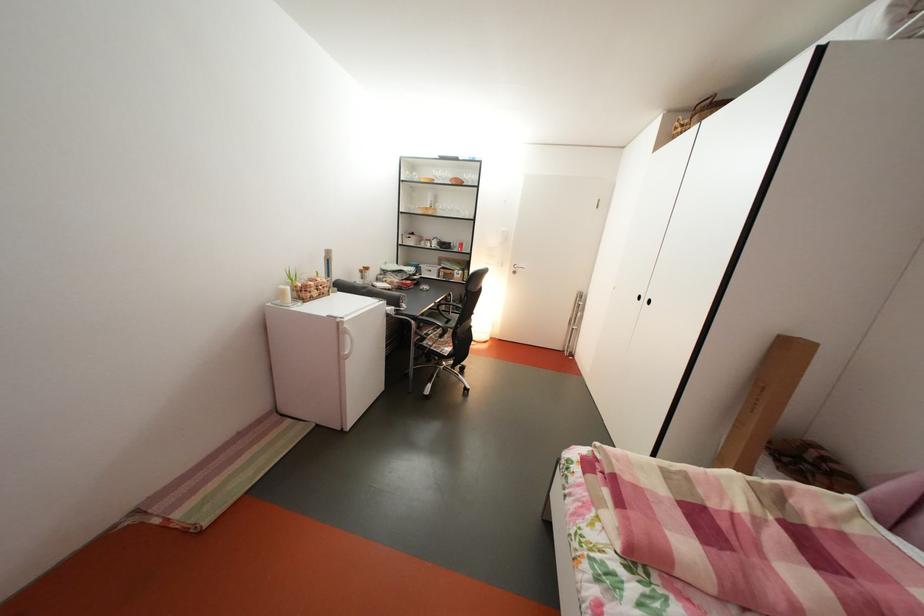
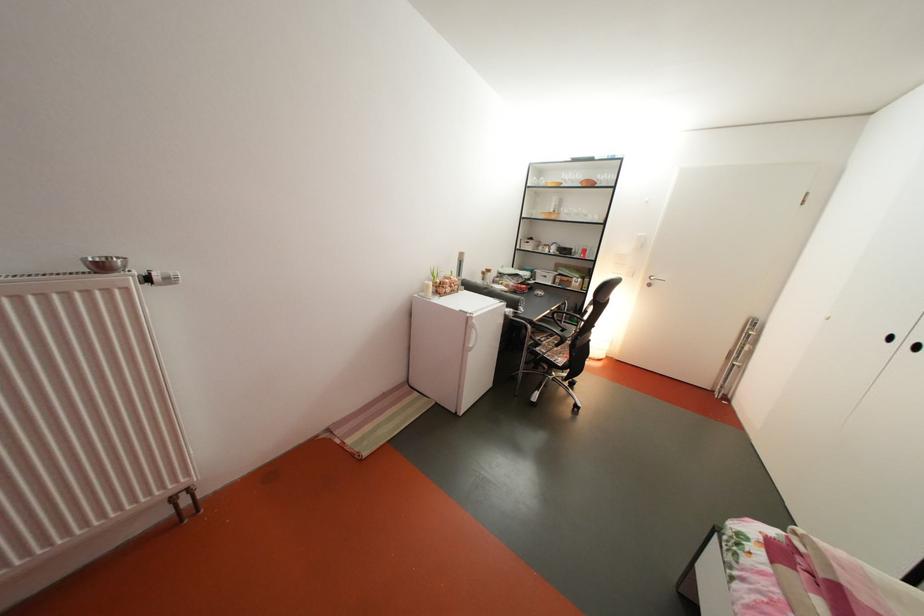
In the second image, find the point that corresponds to (x=459, y=318) in the first image.

(573, 328)